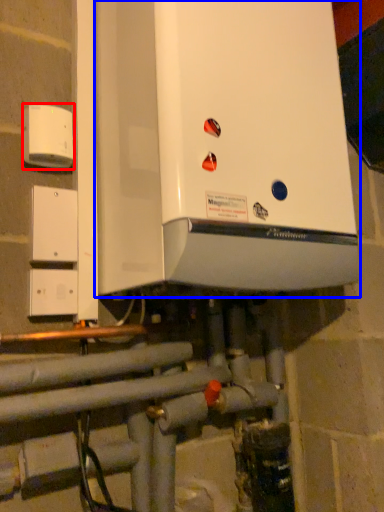
Question: Which object is closer to the camera taking this photo, electric outlet (highlighted by a red box) or home appliance (highlighted by a blue box)?

Choices:
 (A) electric outlet
 (B) home appliance

Answer: (B)